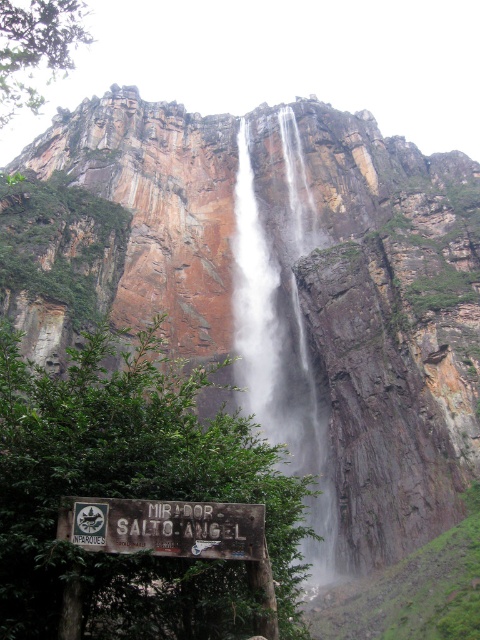
You are standing at the wooden signpost in the foreground of the image. You want to take a photo of the white misty waterfall at center. Which direction should you face to ensure the waterfall is in the center of your camera frame?

Since the white misty waterfall at center is positioned at point coordinates (280, 332), which is near the center of the image, you should face directly towards the waterfall. The coordinates indicate it is already centered, so aligning your camera towards the waterfall will place it in the center of your frame.

You are a photographer standing at the base of the white misty waterfall at center and want to take a photo of the weathered wood sign at lower center. Can you see the sign clearly through the waterfall?

The weathered wood sign at lower center is behind the white misty waterfall at center, so the sign would be obscured by the waterfall and its mist, making it difficult to see clearly through the waterfall.

You are a hiker standing at the wooden signpost in the foreground of the scene. You want to take a photo of the white misty waterfall at center. Considering your camera has a maximum focus range of 75 meters, will you be able to capture the waterfall clearly?

The white misty waterfall at center is 77.19 meters away from the viewer. Since the camera can only focus up to 75 meters, the waterfall is beyond the camera range, so you won generated question and answer based on the provided information. 1. The question must be in English and the answer must be in English. 2. The question should be a single question, and the answer should be a single answer. 3. The question and answer must be enclosed within quotation marks. 4. The question and answer must be formatted